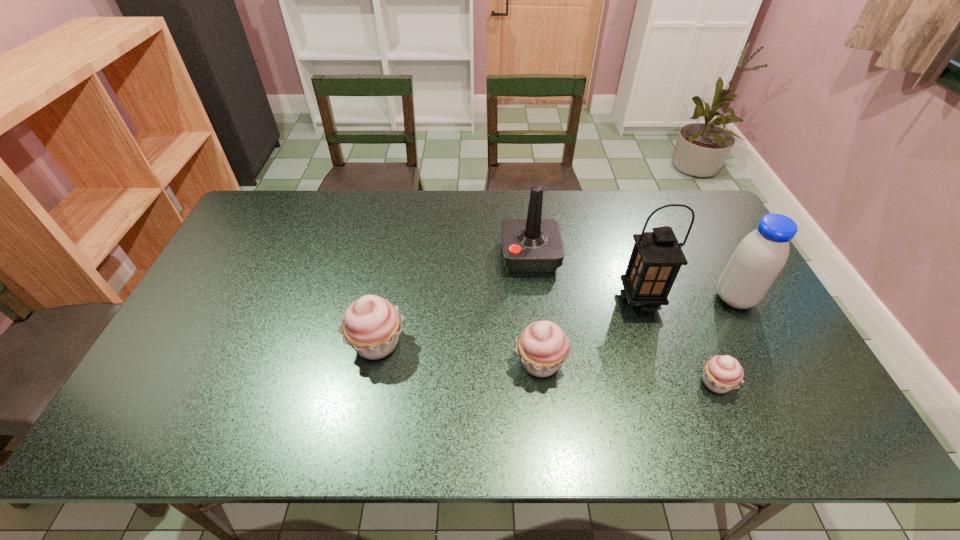
Where is `blank space located 0.230m on the left of the second shortest object`? blank space located 0.230m on the left of the second shortest object is located at coordinates (422, 362).

Identify the location of free space located on the back of the shortest cupcake. [x=664, y=259].

Locate an element on the screen. This screenshot has height=540, width=960. vacant area situated on the left of the farthest object is located at coordinates (463, 256).

You are a GUI agent. You are given a task and a screenshot of the screen. Output one action in this format:
    pyautogui.click(x=<x>, y=<y>)
    Task: Click on the vacant area situated on the back of the lantern
    This screenshot has height=540, width=960.
    Given the screenshot: What is the action you would take?
    pyautogui.click(x=624, y=250)

You are a GUI agent. You are given a task and a screenshot of the screen. Output one action in this format:
    pyautogui.click(x=<x>, y=<y>)
    Task: Click on the vacant space located on the back of the rightmost object
    
    Given the screenshot: What is the action you would take?
    pyautogui.click(x=713, y=258)

Identify the location of object at the right edge. This screenshot has width=960, height=540. (759, 258).

In the image, there is a desktop. At what (x,y) coordinates should I click in order to perform the action: click on free space at the far edge. Please return your answer as a coordinate pair (x, y). Looking at the image, I should click on click(516, 196).

Image resolution: width=960 pixels, height=540 pixels. What are the coordinates of `free region at the left edge` in the screenshot? It's located at (276, 249).

At what (x,y) coordinates should I click in order to perform the action: click on vacant space at the right edge of the desktop. Please return your answer as a coordinate pair (x, y). Looking at the image, I should click on coord(743,367).

Where is `vacant space at the far left corner of the desktop`? Image resolution: width=960 pixels, height=540 pixels. vacant space at the far left corner of the desktop is located at coordinates (299, 205).